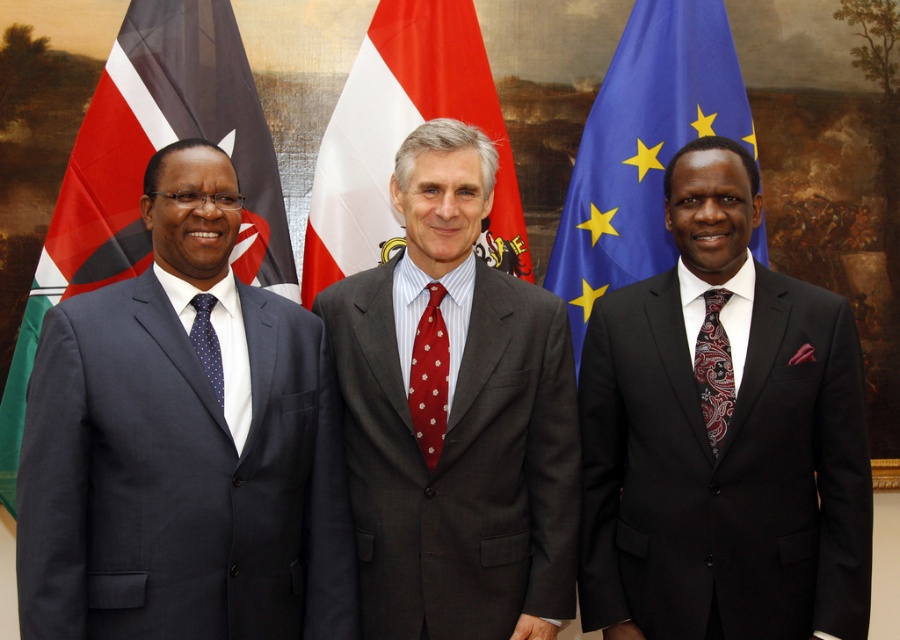
Question: Which object is closer to the camera taking this photo?

Choices:
 (A) blue fabric flag at right
 (B) red flag at left

Answer: (B)

Question: Can you confirm if paisley silk tie at right is thinner than blue dotted tie at center?

Choices:
 (A) no
 (B) yes

Answer: (A)

Question: Which object is the farthest from the paisley silk tie at right?

Choices:
 (A) blue fabric flag at right
 (B) blue dotted tie at center

Answer: (B)

Question: Can you confirm if blue fabric flag at right is positioned above red dotted fabric tie at center?

Choices:
 (A) no
 (B) yes

Answer: (B)

Question: Which point is farther to the camera?

Choices:
 (A) (95, 465)
 (B) (100, 161)

Answer: (B)

Question: Is matte gray suit at center further to camera compared to red dotted fabric tie at center?

Choices:
 (A) no
 (B) yes

Answer: (A)